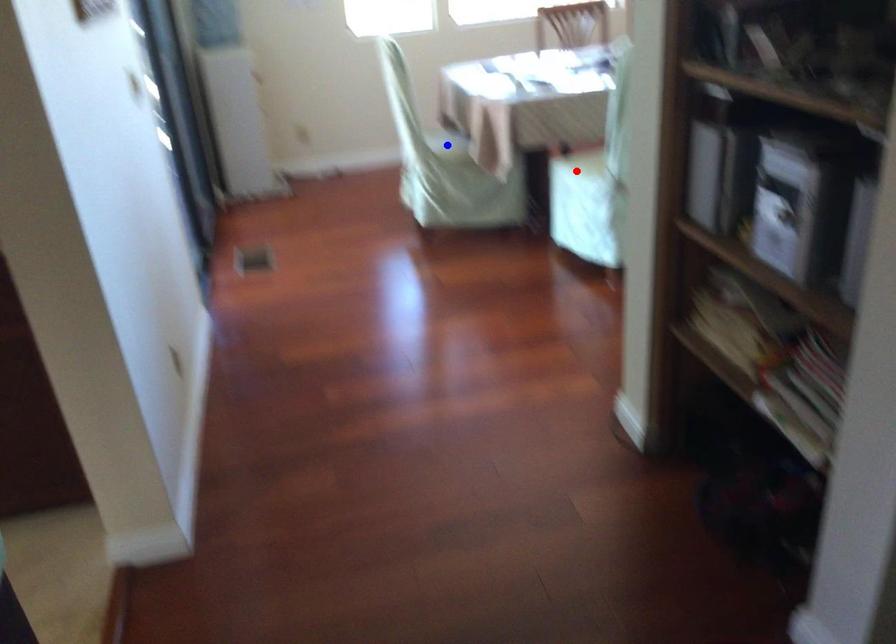
Question: Which of the two points in the image is closer to the camera?

Choices:
 (A) Blue point is closer.
 (B) Red point is closer.

Answer: (B)